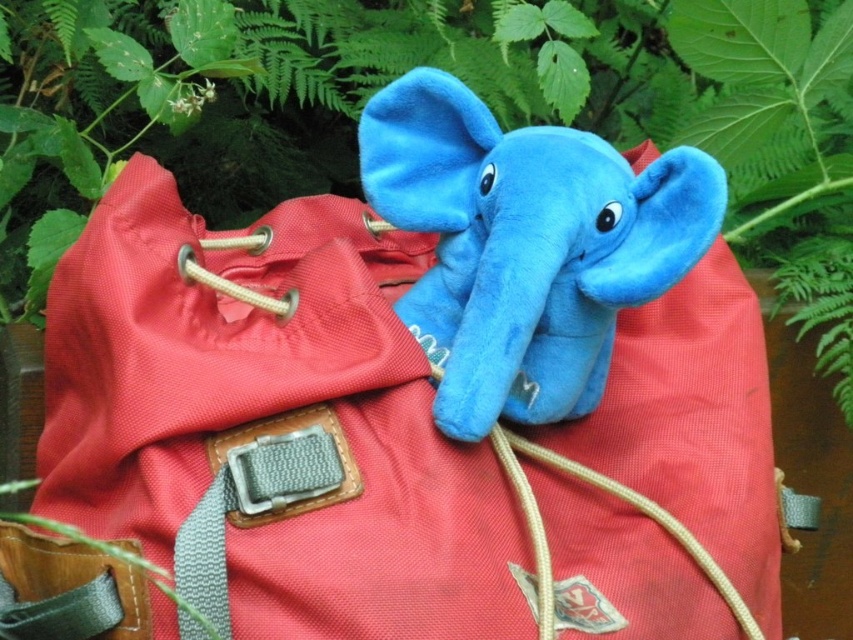
Question: Can you confirm if blue plush toy at center is smaller than matte beige strap at center?

Choices:
 (A) yes
 (B) no

Answer: (B)

Question: Which point appears farthest from the camera in this image?

Choices:
 (A) (538, 513)
 (B) (247, 612)

Answer: (A)

Question: Which of the following is the closest to the observer?

Choices:
 (A) (340, 529)
 (B) (338, 172)
 (C) (531, 512)

Answer: (A)

Question: Which object is farther from the camera taking this photo?

Choices:
 (A) coral fabric backpack at center
 (B) green leafy plant at upper center
 (C) matte beige strap at center
 (D) blue plush toy at center

Answer: (B)

Question: Does coral fabric backpack at center have a lesser width compared to green leafy plant at upper center?

Choices:
 (A) no
 (B) yes

Answer: (B)

Question: Can you confirm if coral fabric backpack at center is positioned below blue plush toy at center?

Choices:
 (A) no
 (B) yes

Answer: (B)